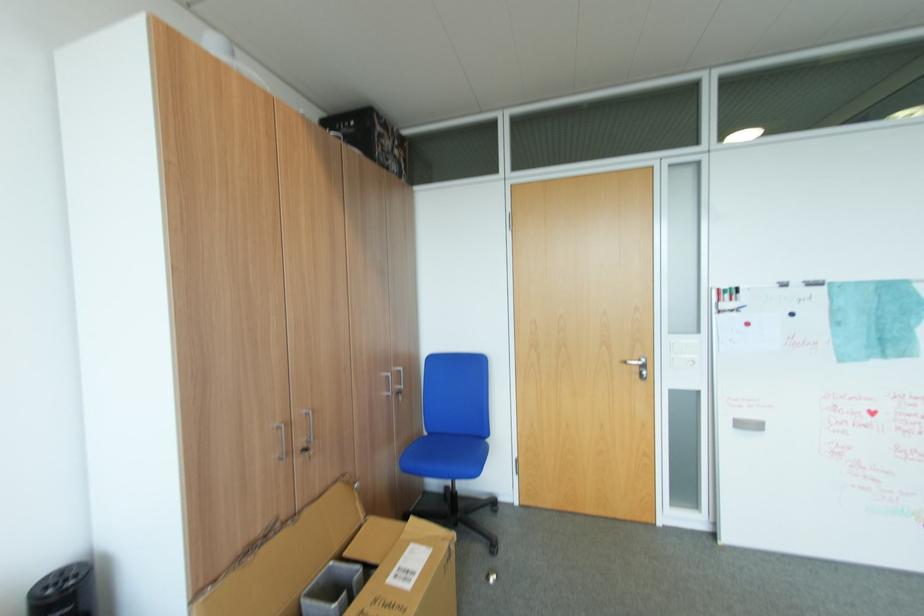
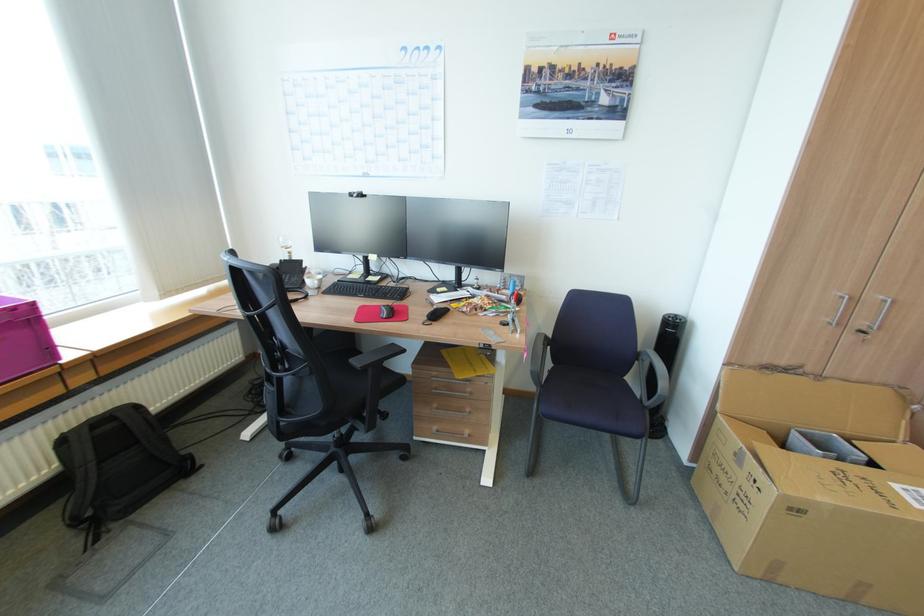
Locate, in the second image, the point that corresponds to the point at 310,451 in the first image.

(868, 331)